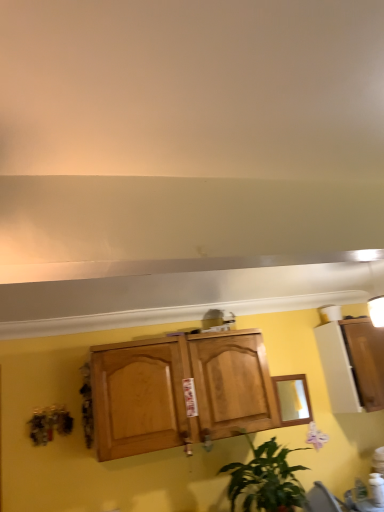
Question: Is green leafy plant at lower center wider or thinner than matte purple flower at lower right?

Choices:
 (A) wide
 (B) thin

Answer: (A)

Question: Considering the positions of point (279, 495) and point (314, 435), is point (279, 495) closer or farther from the camera than point (314, 435)?

Choices:
 (A) farther
 (B) closer

Answer: (B)

Question: Based on their relative distances, which object is nearer to the white glossy cabinet at right?

Choices:
 (A) matte purple flower at lower right
 (B) green leafy plant at lower center
 (C) wooden mirror at center
 (D) matte brown chair at lower right

Answer: (C)

Question: Which object is the closest to the green leafy plant at lower center?

Choices:
 (A) matte purple flower at lower right
 (B) white glossy cabinet at right
 (C) matte brown chair at lower right
 (D) wooden mirror at center

Answer: (C)